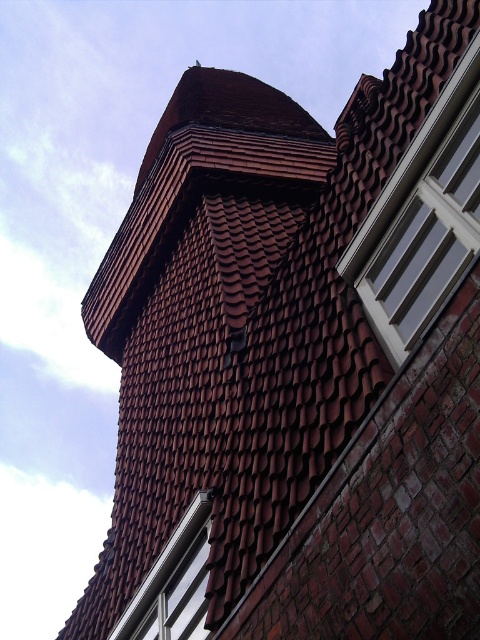
Question: Is white glossy window at upper right below white plastic window at lower left?

Choices:
 (A) no
 (B) yes

Answer: (A)

Question: Which point is closer to the camera taking this photo?

Choices:
 (A) (382, 337)
 (B) (210, 504)

Answer: (A)

Question: Is white glossy window at upper right thinner than white plastic window at lower left?

Choices:
 (A) yes
 (B) no

Answer: (A)

Question: Among these points, which one is farthest from the camera?

Choices:
 (A) (175, 637)
 (B) (399, 308)

Answer: (A)

Question: Is white glossy window at upper right positioned in front of white plastic window at lower left?

Choices:
 (A) yes
 (B) no

Answer: (A)

Question: Which of the following is the closest to the observer?

Choices:
 (A) (184, 554)
 (B) (437, 150)

Answer: (B)